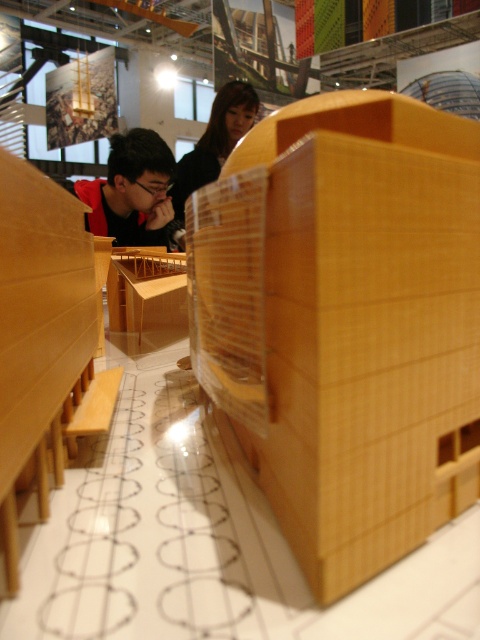
Question: Which point is farther to the camera?

Choices:
 (A) matte black shirt at left
 (B) black hair at upper center

Answer: (B)

Question: Which point is farther to the camera?

Choices:
 (A) matte black shirt at left
 (B) black hair at upper center

Answer: (B)

Question: Which point is closer to the camera?

Choices:
 (A) black hair at upper center
 (B) matte black shirt at left

Answer: (B)

Question: Does matte black shirt at left have a lesser width compared to black hair at upper center?

Choices:
 (A) no
 (B) yes

Answer: (A)

Question: From the image, what is the correct spatial relationship of matte black shirt at left in relation to black hair at upper center?

Choices:
 (A) below
 (B) above

Answer: (A)

Question: Does matte black shirt at left appear under black hair at upper center?

Choices:
 (A) no
 (B) yes

Answer: (B)